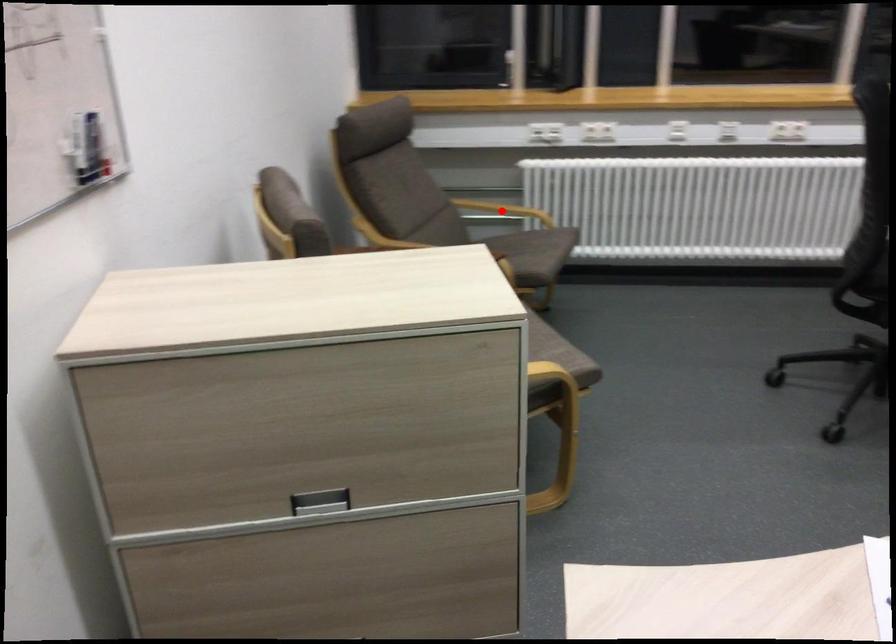
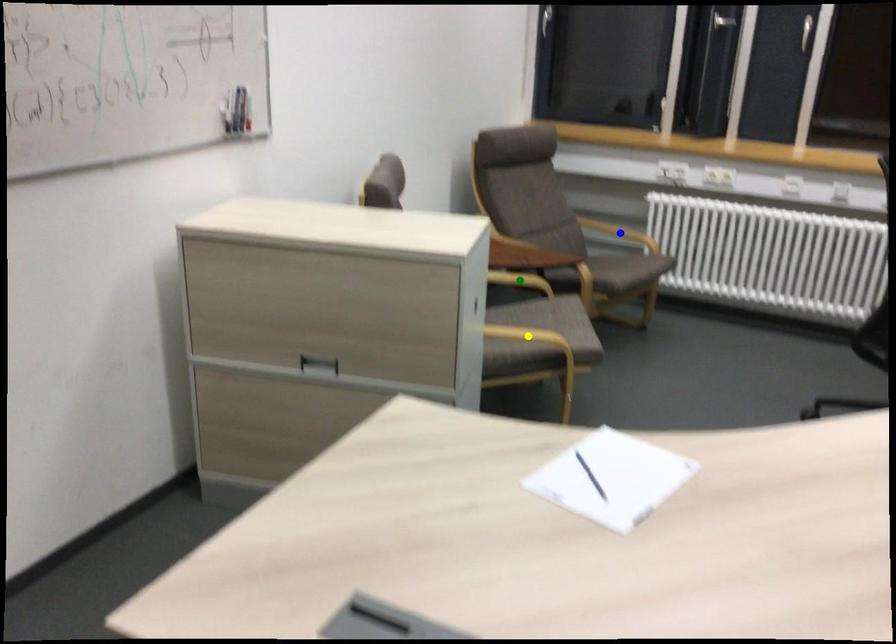
Question: I am providing you with two images of the same scene from different viewpoints. A red point is marked on the first image. You are given multiple points on the second image. Which point in image 2 is actually the same real-world point as the red point in image 1?

Choices:
 (A) yellow point
 (B) blue point
 (C) green point

Answer: (B)